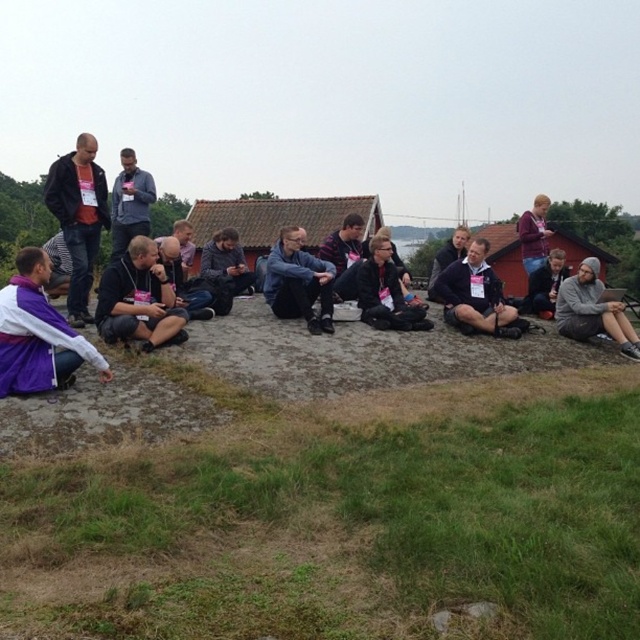
Question: Is dark blue jeans at center positioned at the back of gray fuzzy hoodie at lower right?

Choices:
 (A) no
 (B) yes

Answer: (B)

Question: Considering the relative positions of black fabric shirt at center and blue denim jacket at center in the image provided, where is black fabric shirt at center located with respect to blue denim jacket at center?

Choices:
 (A) left
 (B) right

Answer: (A)

Question: From the image, what is the correct spatial relationship of black fabric shirt at center in relation to dark gray hoodie at left?

Choices:
 (A) above
 (B) below

Answer: (B)

Question: Which point is closer to the camera taking this photo?

Choices:
 (A) (452, 252)
 (B) (172, 241)
 (C) (596, 268)

Answer: (B)

Question: Estimate the real-world distances between objects in this image. Which object is closer to the dark blue shirt at upper left?

Choices:
 (A) dark blue jeans at center
 (B) dark gray hoodie at left

Answer: (B)

Question: Among these points, which one is farthest from the camera?

Choices:
 (A) (490, 305)
 (B) (352, 289)
 (C) (460, 227)
 (D) (593, 320)

Answer: (C)